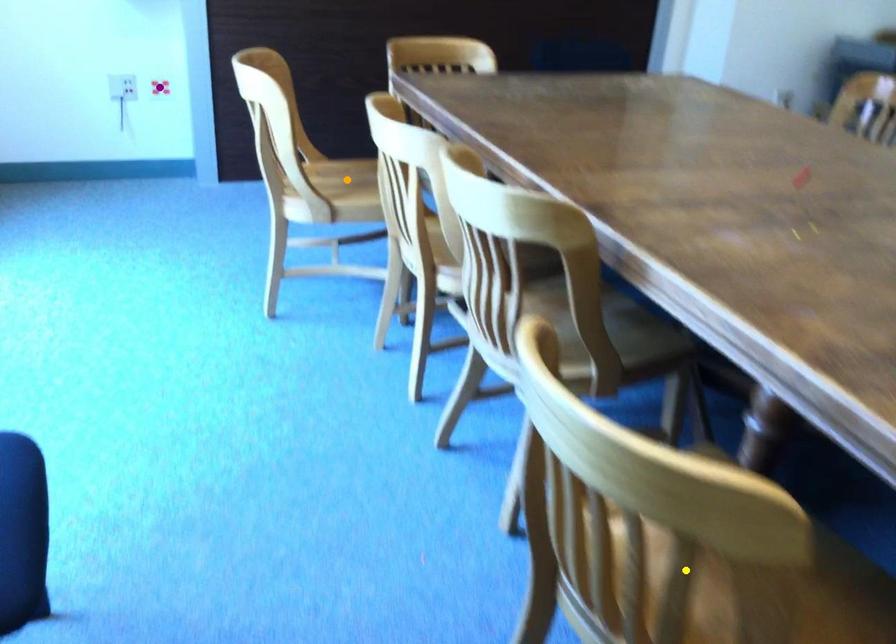
Order these from nearest to farthest:
orange point, yellow point, purple point

yellow point < orange point < purple point